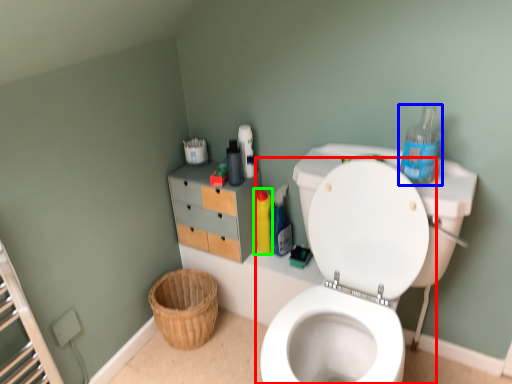
Question: Which object is the closest to the toilet (highlighted by a red box)? Choose among these: cleaning product (highlighted by a blue box) or cleaning product (highlighted by a green box).

Choices:
 (A) cleaning product
 (B) cleaning product

Answer: (A)